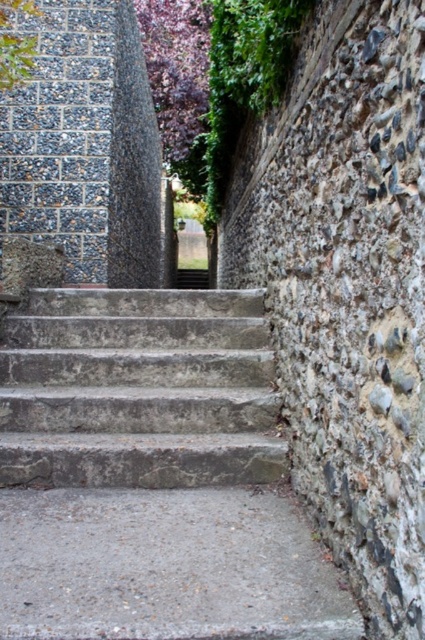
You are standing at the bottom of the staircase and want to reach the upper part of the wall with ivy. You notice two points marked on the wall. Which point is closer to you, point (102, 385) or point (28, 417)?

Point (102, 385) is further to the viewer than point (28, 417), so the closer point is point (28, 417).

You are standing at the bottom of the staircase and need to climb up. The gray concrete stairs at center and the gray stone stairs at center are both in front of you. Which set of stairs should you step onto first if you want to take the wider path?

You should step onto the gray concrete stairs at center first because it is larger in size than the gray stone stairs at center, making it the wider path.